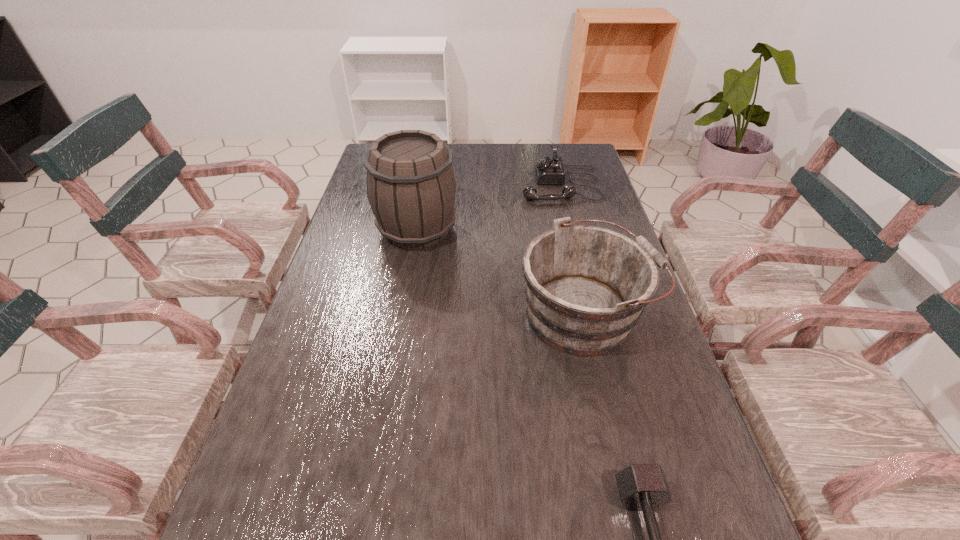
Find the location of a particular element. This screenshot has height=540, width=960. vacant area between the taller wine bucket and the second tallest object is located at coordinates (501, 271).

You are a GUI agent. You are given a task and a screenshot of the screen. Output one action in this format:
    pyautogui.click(x=<x>, y=<y>)
    Task: Click on the vacant area that lies between the third shortest object and the taller wine bucket
    The image size is (960, 540).
    Given the screenshot: What is the action you would take?
    pyautogui.click(x=501, y=271)

Locate an element on the screen. The image size is (960, 540). the third closest object to the shorter wine bucket is located at coordinates (548, 170).

This screenshot has width=960, height=540. In order to click on object that can be found as the third closest to the nearer wine bucket in this screenshot , I will do tap(548, 170).

Where is `free spot that satisfies the following two spatial constraints: 1. on the dial of the third tallest object; 2. on the front side of the right wine bucket`? free spot that satisfies the following two spatial constraints: 1. on the dial of the third tallest object; 2. on the front side of the right wine bucket is located at coordinates (592, 313).

Find the location of a particular element. This screenshot has width=960, height=540. free spot that satisfies the following two spatial constraints: 1. on the dial of the farthest object; 2. on the front side of the shorter wine bucket is located at coordinates (592, 313).